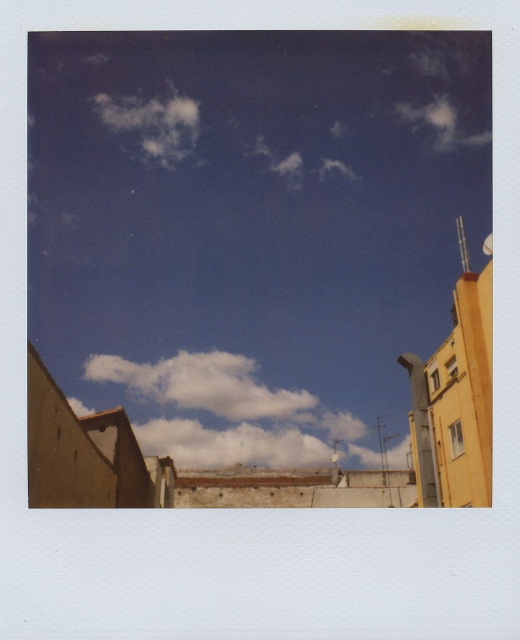
Does point (214, 384) come closer to viewer compared to point (169, 90)?

Yes, it is in front of point (169, 90).

Does white fluffy cloud at center have a lesser height compared to white fluffy cloud at upper left?

Yes.

Describe the element at coordinates (201, 385) in the screenshot. I see `white fluffy cloud at center` at that location.

Where is `white fluffy cloud at center`? The image size is (520, 640). white fluffy cloud at center is located at coordinates click(x=201, y=385).